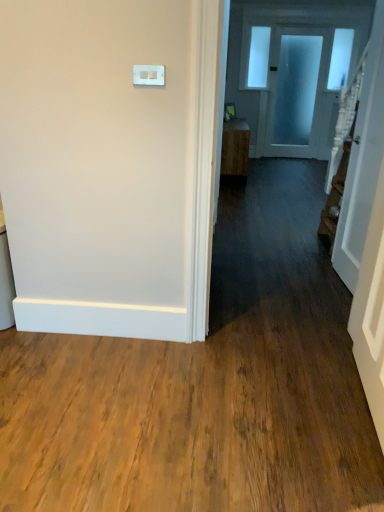
Question: Is frosted glass door at upper center, the 1th door from the top, situated inside wooden cabinet at center or outside?

Choices:
 (A) inside
 (B) outside

Answer: (B)

Question: Is frosted glass door at upper center, the 1th door from the top, taller or shorter than wooden cabinet at center?

Choices:
 (A) tall
 (B) short

Answer: (A)

Question: Which object is positioned closest to the frosted glass door at upper center, the first door viewed from the right?

Choices:
 (A) wooden cabinet at center
 (B) white glossy door at right, which appears as the second door when viewed from the back
 (C) white plastic light switch at upper center

Answer: (A)

Question: Which is farther from the white plastic light switch at upper center?

Choices:
 (A) white glossy door at right, which appears as the second door when viewed from the back
 (B) wooden cabinet at center
 (C) frosted glass door at upper center, placed as the 1th door when sorted from back to front

Answer: (C)